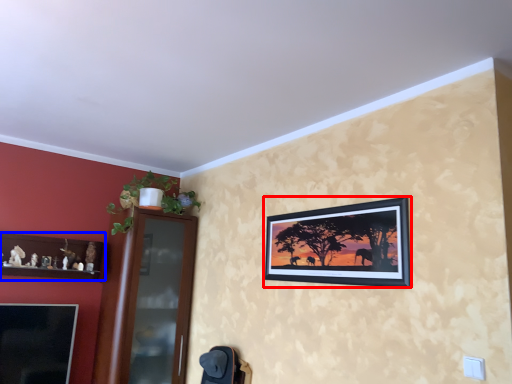
Question: Which of the following is the farthest to the observer, picture frame (highlighted by a red box) or shelf (highlighted by a blue box)?

Choices:
 (A) picture frame
 (B) shelf

Answer: (B)